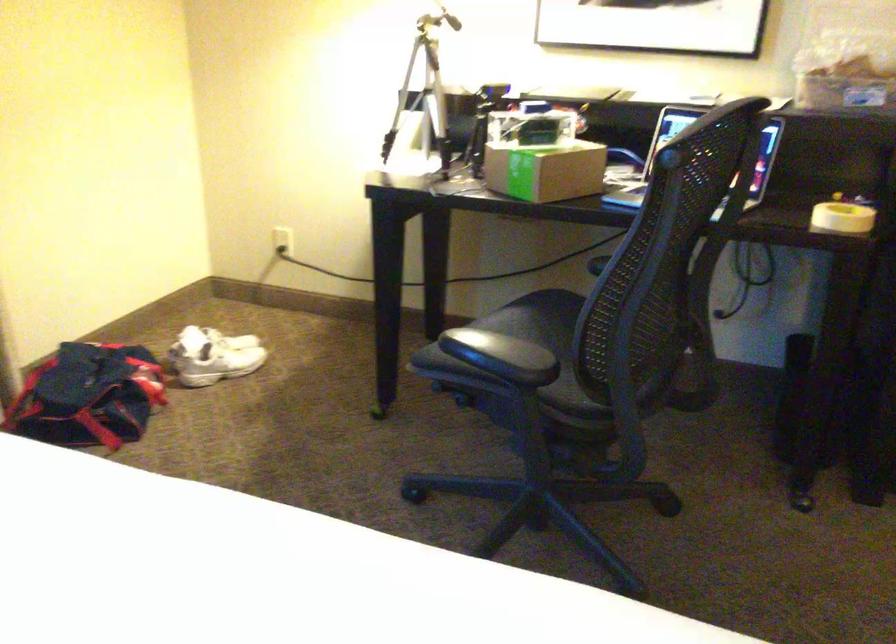
The height and width of the screenshot is (644, 896). Identify the location of white shoe. click(x=213, y=355).